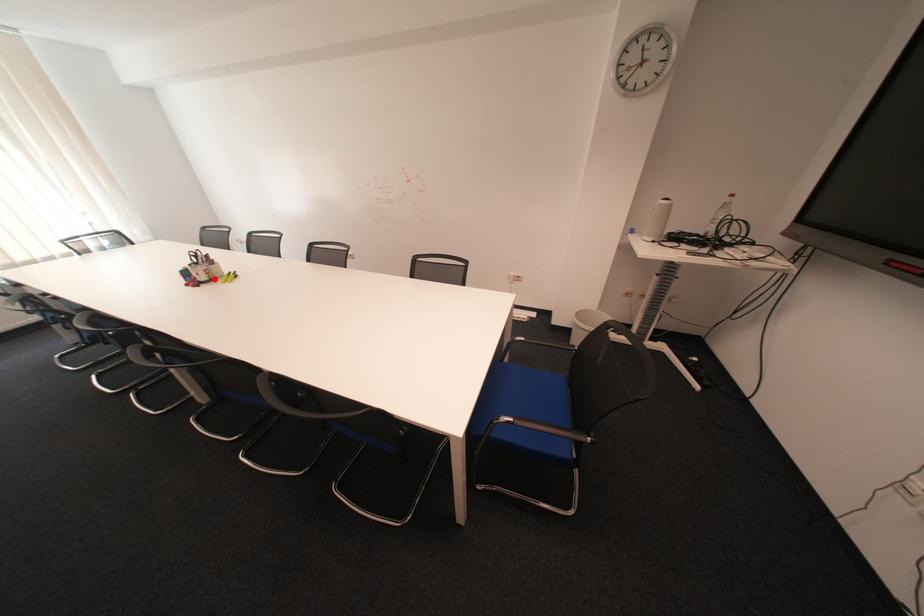
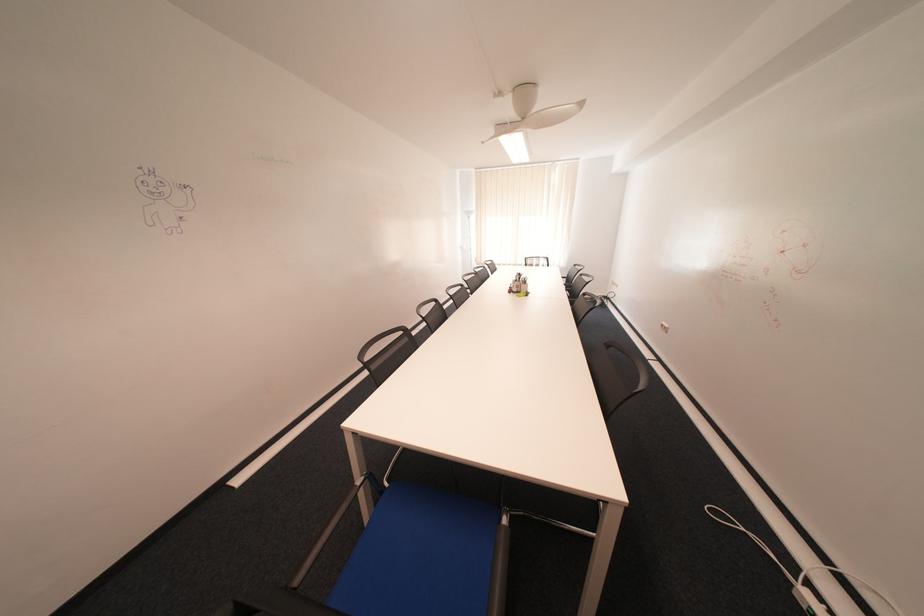
Locate, in the second image, the point that corresponds to the highlighted location in the first image.

(526, 290)